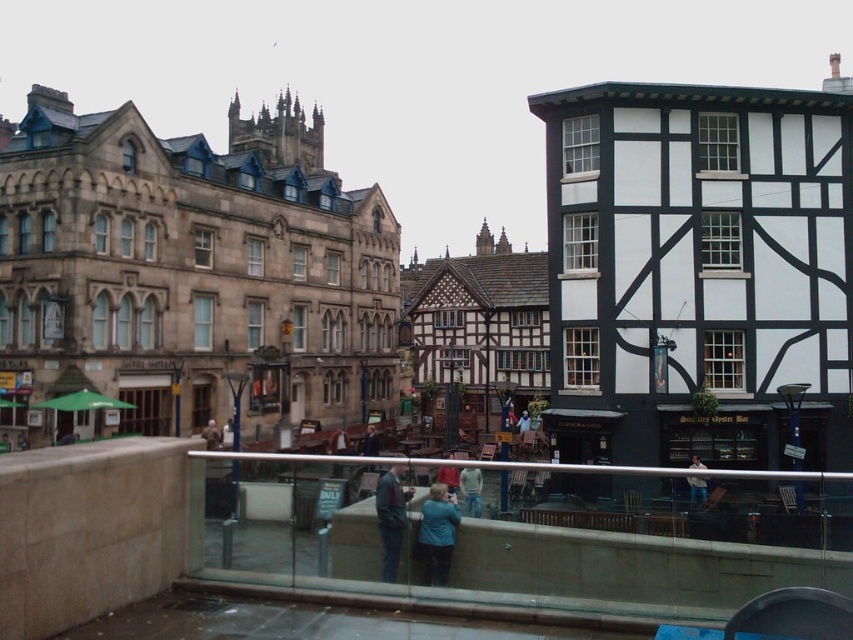
Does blue fabric jacket at center have a greater width compared to blue denim jacket at center?

No.

Which is below, blue fabric jacket at center or blue denim jacket at center?

Positioned lower is blue denim jacket at center.

The image size is (853, 640). Find the location of `blue fabric jacket at center`. blue fabric jacket at center is located at coordinates (437, 532).

Does white cotton shirt at center appear on the left side of light brown leather jacket at center?

No, white cotton shirt at center is not to the left of light brown leather jacket at center.

In the scene shown: Which of these two, white cotton shirt at center or light brown leather jacket at center, stands shorter?

light brown leather jacket at center

Is point (695, 500) less distant than point (209, 420)?

Yes, point (695, 500) is in front of point (209, 420).

Identify the location of white cotton shirt at center. The height and width of the screenshot is (640, 853). 695,490.

Is light brown leather jacket at center to the left of blue denim jacket at center from the viewer's perspective?

Correct, you'll find light brown leather jacket at center to the left of blue denim jacket at center.

Looking at this image, between light brown leather jacket at center and blue denim jacket at center, which one is positioned higher?

blue denim jacket at center

Does point (207, 440) come behind point (526, 420)?

No, (207, 440) is closer to viewer.

Find the location of a particular element. light brown leather jacket at center is located at coordinates (212, 435).